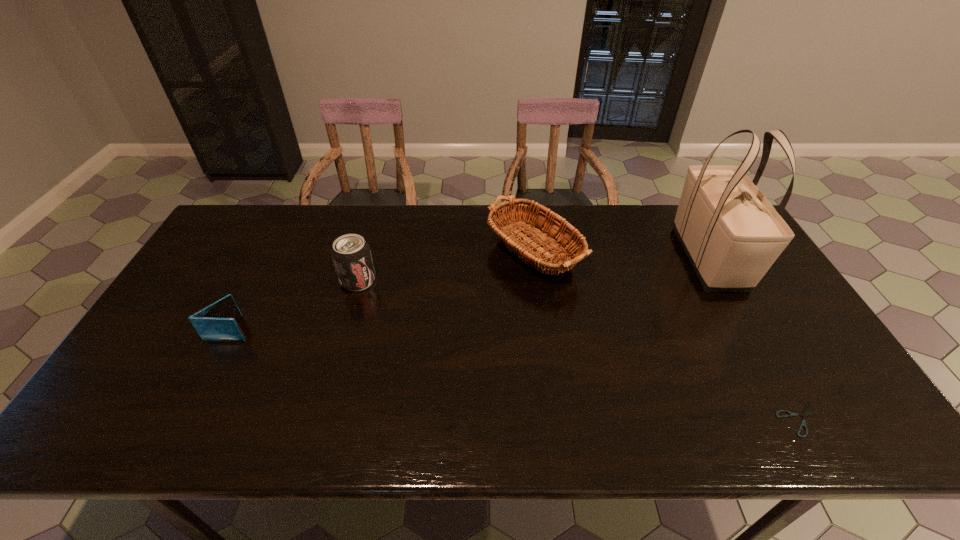
Locate an element on the screen. unoccupied position between the shears and the shopping bag is located at coordinates (756, 339).

You are a GUI agent. You are given a task and a screenshot of the screen. Output one action in this format:
    pyautogui.click(x=<x>, y=<y>)
    Task: Click on the free space that is in between the third object from right to left and the shortest object
    The height and width of the screenshot is (540, 960).
    Given the screenshot: What is the action you would take?
    (666, 333)

Where is `vacant region between the tallest object and the leftmost object`? vacant region between the tallest object and the leftmost object is located at coordinates (470, 294).

Image resolution: width=960 pixels, height=540 pixels. I want to click on vacant point located between the shopping bag and the second shortest object, so click(x=470, y=294).

Where is `object that is the fourth closest to the third object from left to right`? object that is the fourth closest to the third object from left to right is located at coordinates (217, 322).

Identify which object is located as the second nearest to the wallet. Please provide its 2D coordinates. Your answer should be formatted as a tuple, i.e. [(x, y)], where the tuple contains the x and y coordinates of a point satisfying the conditions above.

[(541, 227)]

The width and height of the screenshot is (960, 540). In order to click on free space in the image that satisfies the following two spatial constraints: 1. with handles facing forward on the shopping bag; 2. on the right side of the shears in this screenshot , I will do `click(799, 419)`.

Locate an element on the screen. The height and width of the screenshot is (540, 960). vacant area in the image that satisfies the following two spatial constraints: 1. with handles facing forward on the shortest object; 2. on the left side of the tallest object is located at coordinates (799, 419).

Locate an element on the screen. The width and height of the screenshot is (960, 540). free space that satisfies the following two spatial constraints: 1. with handles facing forward on the tallest object; 2. on the right side of the shortest object is located at coordinates (799, 419).